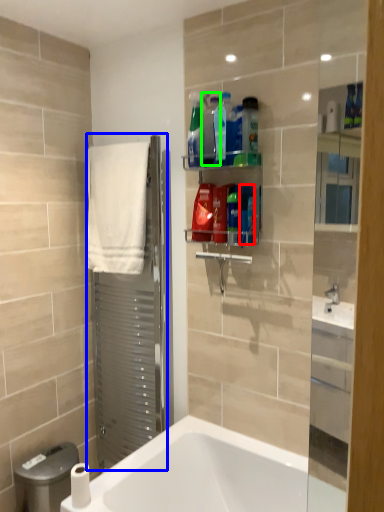
Question: Which is farther away from cleaning product (highlighted by a red box)? screen door (highlighted by a blue box) or cleaning product (highlighted by a green box)?

Choices:
 (A) screen door
 (B) cleaning product

Answer: (A)